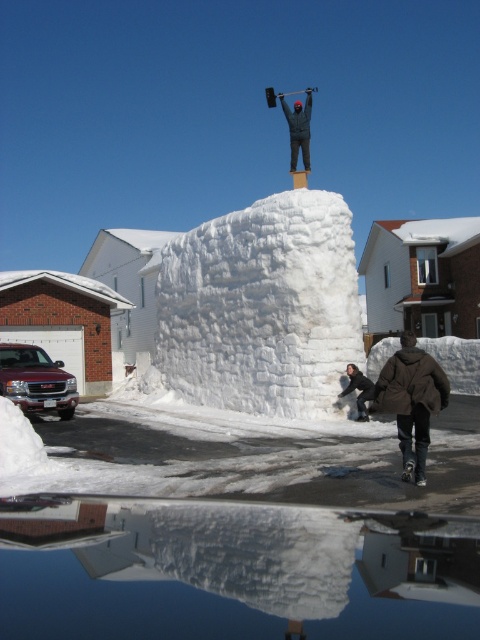
Between brown fuzzy coat at lower right and white snowboard at lower right, which one is positioned higher?

brown fuzzy coat at lower right

Which of these two, brown fuzzy coat at lower right or white snowboard at lower right, stands taller?

white snowboard at lower right

This screenshot has height=640, width=480. What do you see at coordinates (410, 401) in the screenshot?
I see `brown fuzzy coat at lower right` at bounding box center [410, 401].

This screenshot has width=480, height=640. Find the location of `brown fuzzy coat at lower right`. brown fuzzy coat at lower right is located at coordinates (410, 401).

Can you confirm if white snow block at center is taller than brown fuzzy coat at lower right?

Yes, white snow block at center is taller than brown fuzzy coat at lower right.

Is the position of white snow block at center more distant than that of brown fuzzy coat at lower right?

Yes, it is behind brown fuzzy coat at lower right.

Which is in front, point (348, 326) or point (436, 392)?

Point (436, 392)

I want to click on white snow block at center, so click(x=262, y=307).

Who is positioned more to the left, white snow block at center or white snowboard at lower right?

white snow block at center

Based on the photo, can you confirm if white snow block at center is smaller than white snowboard at lower right?

Actually, white snow block at center might be larger than white snowboard at lower right.

Does point (276, 193) lie in front of point (352, 368)?

That is False.

I want to click on white snow block at center, so click(x=262, y=307).